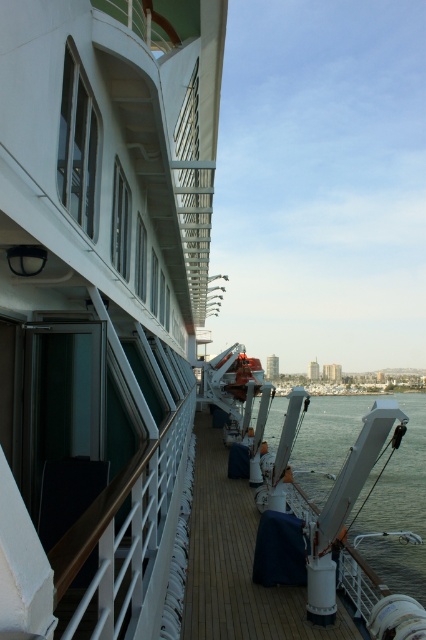
Is matte white deck at center to the left of white glossy water at center from the viewer's perspective?

Indeed, matte white deck at center is positioned on the left side of white glossy water at center.

Is matte white deck at center further to camera compared to white glossy water at center?

No, matte white deck at center is in front of white glossy water at center.

You are a GUI agent. You are given a task and a screenshot of the screen. Output one action in this format:
    pyautogui.click(x=<x>, y=<y>)
    Task: Click on the matte white deck at center
    The width and height of the screenshot is (426, 640).
    Given the screenshot: What is the action you would take?
    pyautogui.click(x=236, y=563)